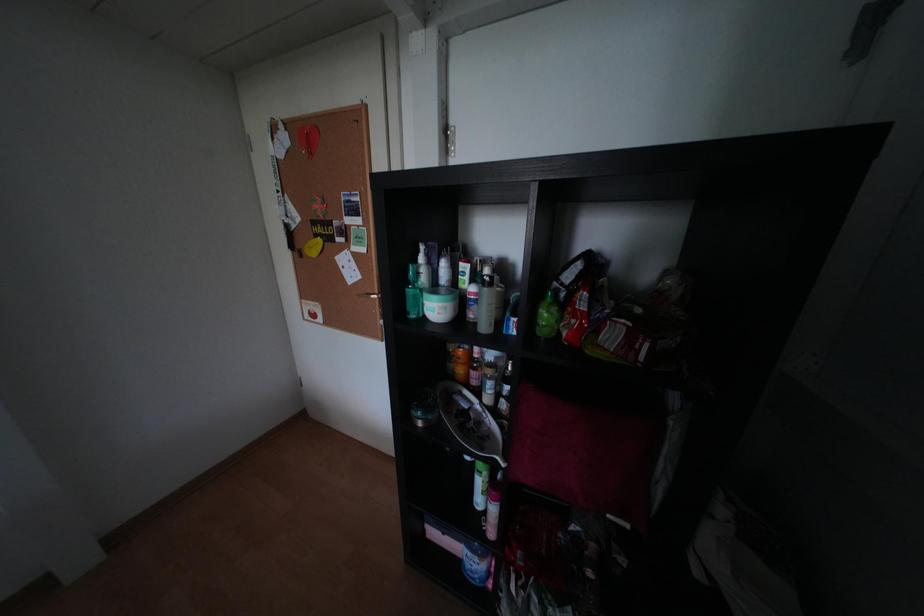
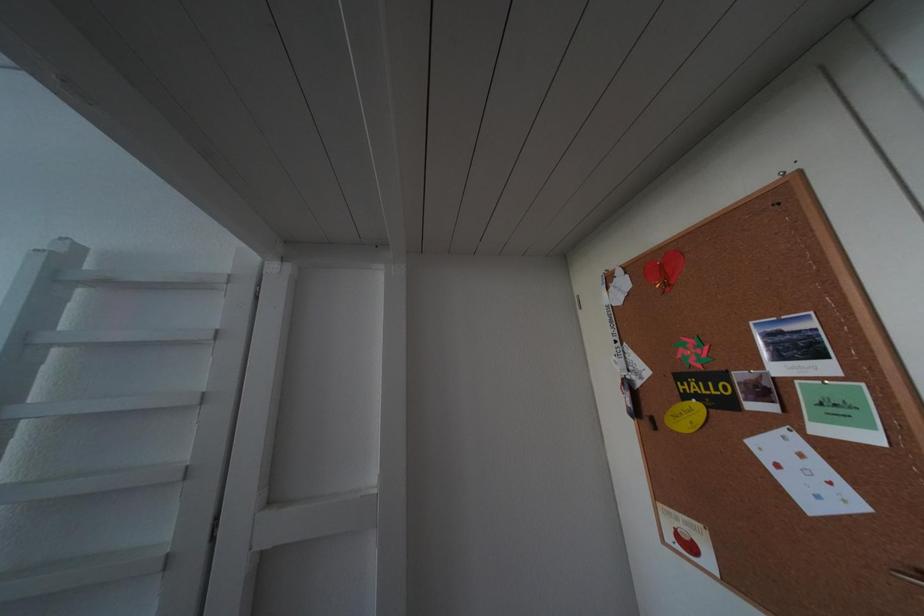
First-person continuous shooting, in which direction is the camera rotating?

The camera rotated toward left-up.